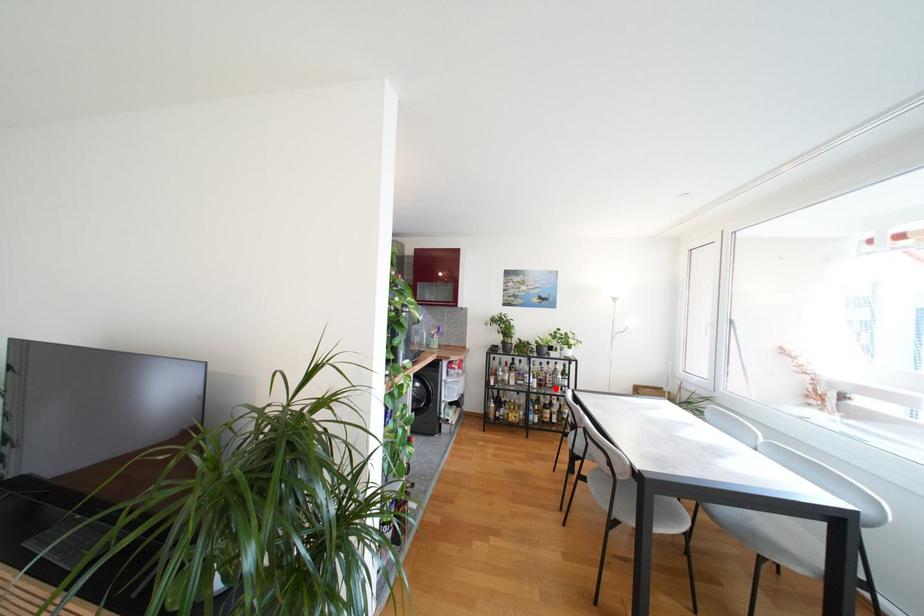
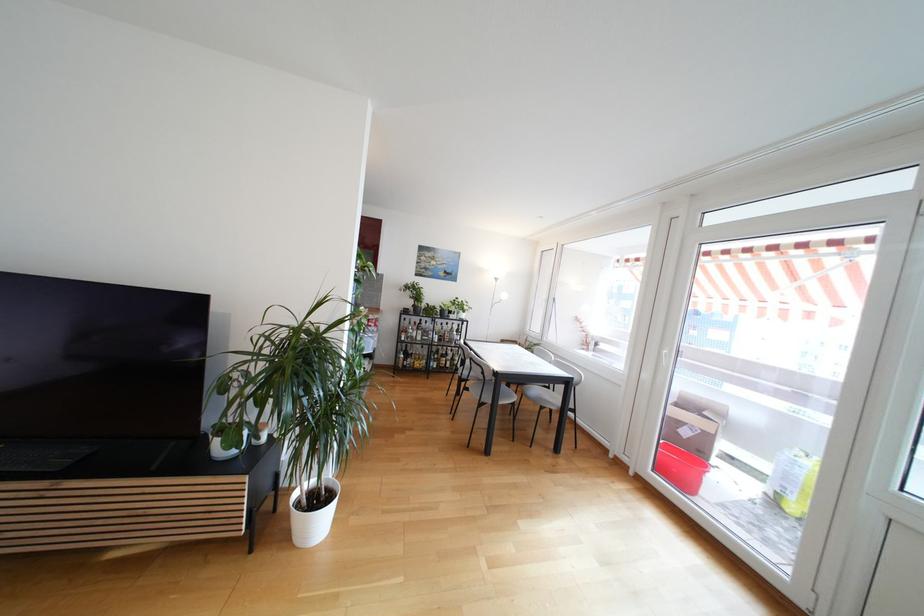
Locate, in the second image, the point that corresponds to the highlighted location in the first image.

(453, 342)